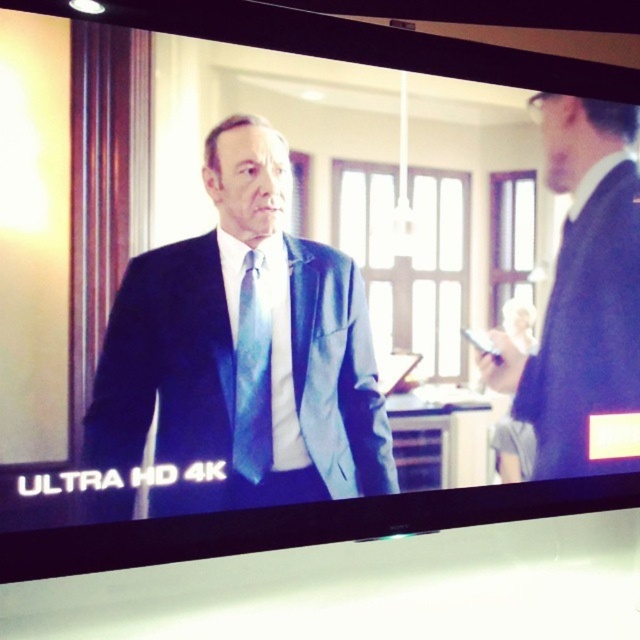
Question: Can you confirm if satin black suit at right is thinner than blue silk tie at center?

Choices:
 (A) no
 (B) yes

Answer: (A)

Question: Estimate the real-world distances between objects in this image. Which object is farther from the blue silk tie at center?

Choices:
 (A) matte blue suit at center
 (B) satin black suit at right

Answer: (B)

Question: Where is matte blue suit at center located in relation to satin black suit at right in the image?

Choices:
 (A) left
 (B) right

Answer: (A)

Question: Which point is closer to the camera?

Choices:
 (A) matte blue suit at center
 (B) satin black suit at right
 (C) blue silk tie at center

Answer: (A)

Question: Among these objects, which one is farthest from the camera?

Choices:
 (A) satin black suit at right
 (B) matte blue suit at center
 (C) blue silk tie at center

Answer: (A)

Question: Does satin black suit at right appear under blue silk tie at center?

Choices:
 (A) no
 (B) yes

Answer: (A)